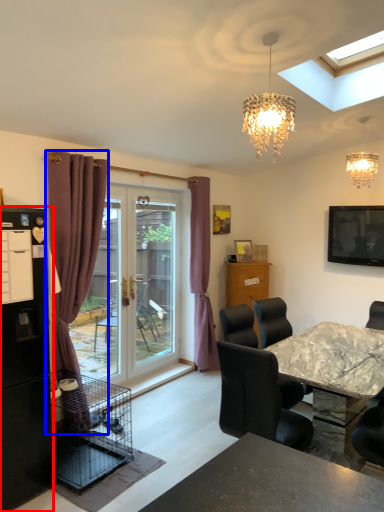
Question: Which object is closer to the camera taking this photo, refrigerator (highlighted by a red box) or curtain (highlighted by a blue box)?

Choices:
 (A) refrigerator
 (B) curtain

Answer: (A)